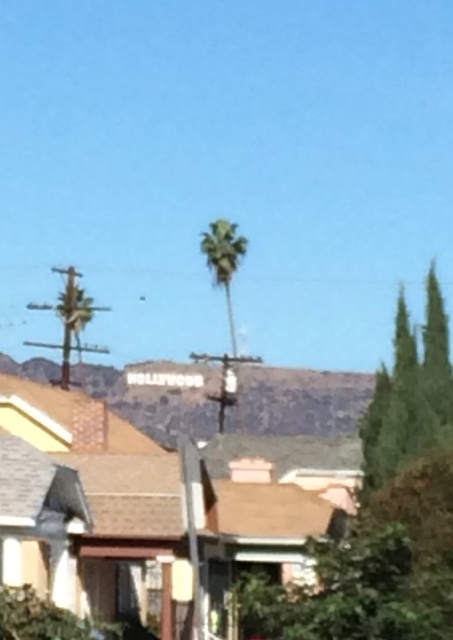
Between green leafy tree at right and green leafy palm at center, which one is positioned higher?

green leafy palm at center

Describe the element at coordinates (409, 392) in the screenshot. I see `green leafy tree at right` at that location.

At what (x,y) coordinates should I click in order to perform the action: click on green leafy tree at right. Please return your answer as a coordinate pair (x, y). The height and width of the screenshot is (640, 453). Looking at the image, I should click on (409, 392).